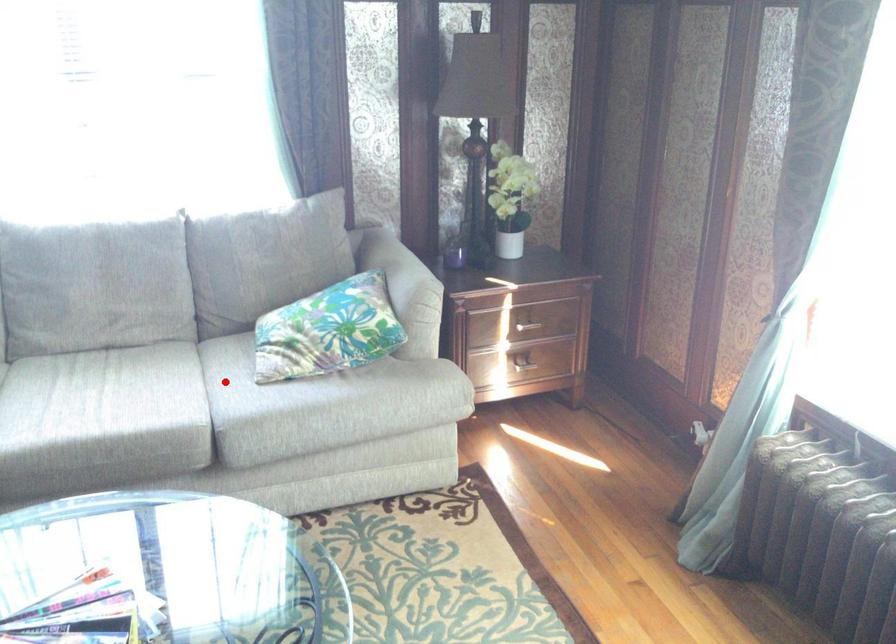
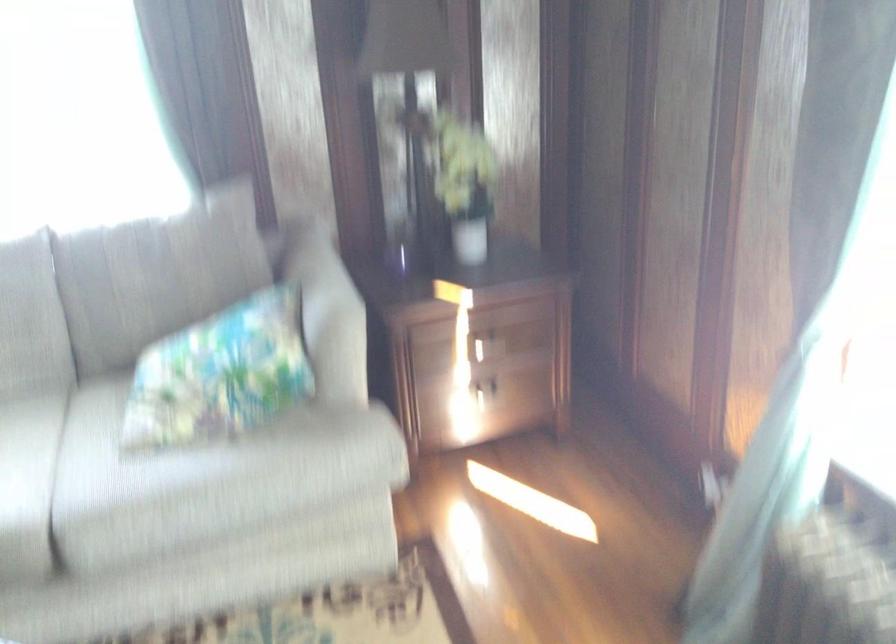
The point at the highlighted location is marked in the first image. Where is the corresponding point in the second image?

(88, 448)